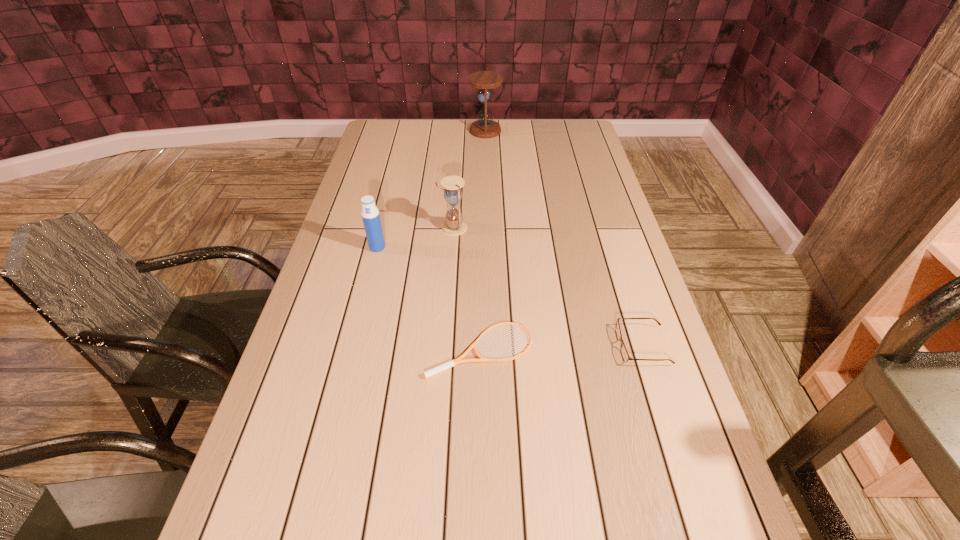
I want to click on free space that is in between the fourth nearest object and the tennis racket, so click(x=468, y=288).

Locate an element on the screen. The image size is (960, 540). free space between the tennis racket and the farthest object is located at coordinates (483, 239).

Locate which object is the third closest to the shortest object. Please provide its 2D coordinates. Your answer should be formatted as a tuple, i.e. [(x, y)], where the tuple contains the x and y coordinates of a point satisfying the conditions above.

[(454, 225)]

Where is `object identified as the closest to the tennis racket`? Image resolution: width=960 pixels, height=540 pixels. object identified as the closest to the tennis racket is located at coordinates (625, 356).